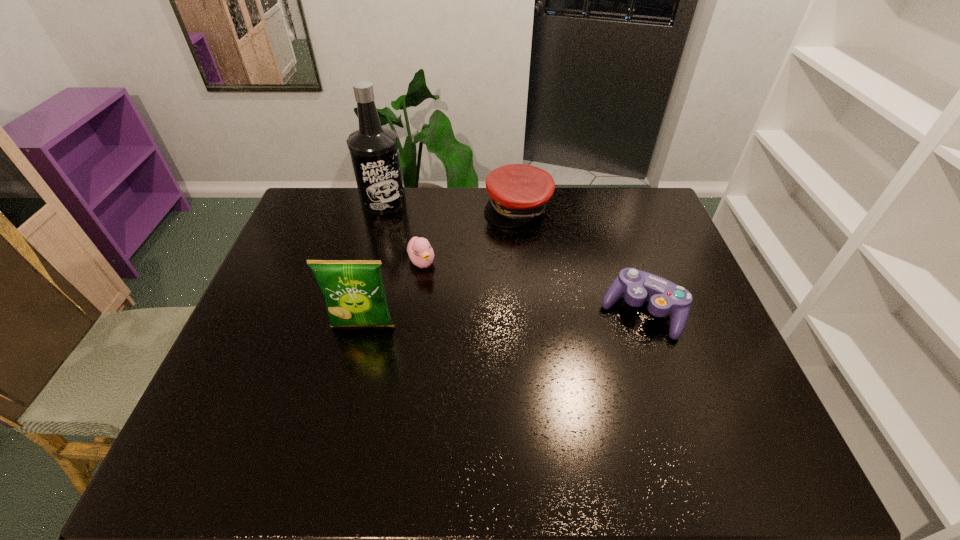
This screenshot has height=540, width=960. Identify the location of vacant area at the far edge of the desktop. (444, 218).

Where is `vacant area at the near edge`? This screenshot has width=960, height=540. vacant area at the near edge is located at coordinates (290, 407).

This screenshot has width=960, height=540. In the image, there is a desktop. Find the location of `vacant space at the left edge`. vacant space at the left edge is located at coordinates (266, 363).

Identify the location of free space at the right edge of the desktop. (657, 267).

This screenshot has height=540, width=960. What are the coordinates of `vacant space at the far right corner of the desktop` in the screenshot? It's located at (623, 208).

Locate an element on the screen. vacant region at the near right corner of the desktop is located at coordinates (717, 393).

Identify the location of free area in between the cap and the liquor. The width and height of the screenshot is (960, 540). (451, 205).

Where is `vacant space that's between the control and the cap`? The image size is (960, 540). vacant space that's between the control and the cap is located at coordinates (580, 260).

You are a GUI agent. You are given a task and a screenshot of the screen. Output one action in this format:
    pyautogui.click(x=<x>, y=<y>)
    Task: Click on the blank region between the fourth object from left to right and the fourth shortest object
    This screenshot has width=960, height=540.
    Given the screenshot: What is the action you would take?
    pyautogui.click(x=441, y=266)

The image size is (960, 540). I want to click on free area in between the tallest object and the control, so click(x=513, y=257).